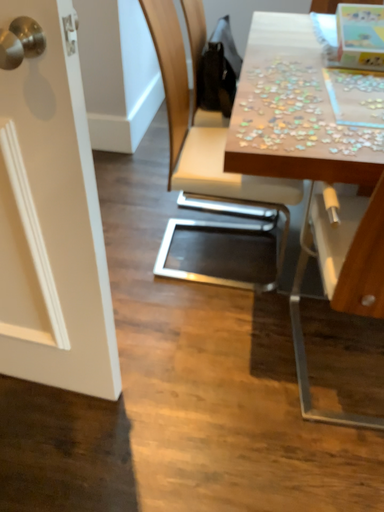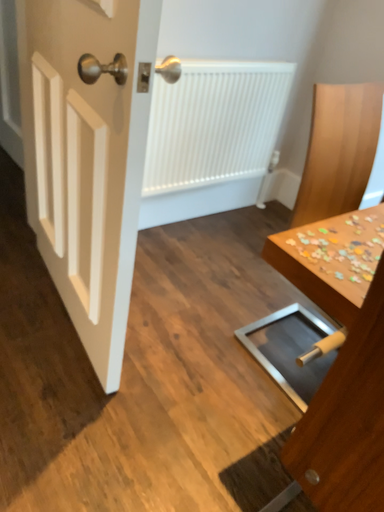
Question: How did the camera likely rotate when shooting the video?

Choices:
 (A) rotated upward
 (B) rotated downward

Answer: (A)